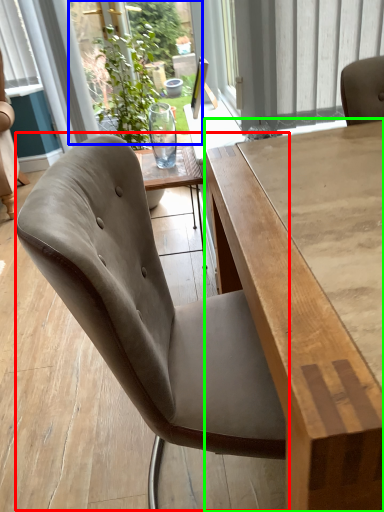
Question: Which object is the closest to the chair (highlighted by a red box)? Choose among these: window screen (highlighted by a blue box) or table (highlighted by a green box).

Choices:
 (A) window screen
 (B) table

Answer: (B)